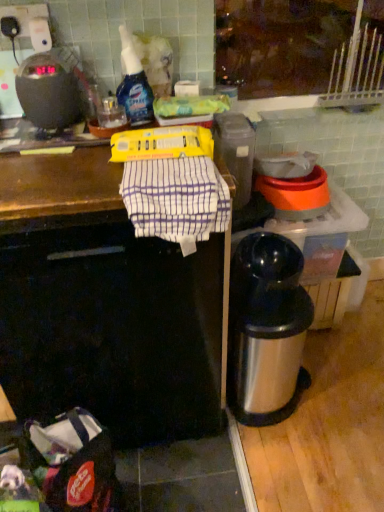
Describe the element at coordinates (50, 91) in the screenshot. This screenshot has height=512, width=384. I see `black plastic scale at upper left` at that location.

This screenshot has width=384, height=512. I want to click on white striped cloth at center, so click(176, 200).

Locate an element on the screen. This screenshot has width=384, height=512. white striped cloth at center is located at coordinates (105, 307).

Identify the location of black plastic scale at upper left. The image size is (384, 512). (50, 91).

Which object is closer to the camera taking this photo, black plastic scale at upper left or white striped cloth at center?

white striped cloth at center is in front.

Where is `kitchen appliance above the white striped cloth at center (from the image's perspective)`? This screenshot has height=512, width=384. kitchen appliance above the white striped cloth at center (from the image's perspective) is located at coordinates (50, 91).

Is black plastic scale at upper left oriented towards white striped cloth at center?

No, black plastic scale at upper left is not facing towards white striped cloth at center.

From the picture: How many degrees apart are the facing directions of black plastic scale at upper left and white striped cloth at center?

0.00224 degrees separate the facing orientations of black plastic scale at upper left and white striped cloth at center.

Does black plastic scale at upper left have a greater height compared to white striped cloth at center?

No, black plastic scale at upper left is not taller than white striped cloth at center.

From a real-world perspective, does black plastic scale at upper left sit lower than white striped cloth at center?

Incorrect, from a real-world perspective, black plastic scale at upper left is higher than white striped cloth at center.

How much distance is there between black plastic scale at upper left and white striped cloth at center?

black plastic scale at upper left and white striped cloth at center are 20.41 inches apart.

Which object is wider, black plastic scale at upper left or white striped cloth at center?

Wider between the two is white striped cloth at center.

Is translucent plastic spray bottle at upper center not near white striped cloth at center?

They are positioned close to each other.

What are the coordinates of `laundry below the translucent plastic spray bottle at upper center (from a real-world perspective)` in the screenshot? It's located at (176, 200).

Considering the sizes of translucent plastic spray bottle at upper center and white striped cloth at center in the image, is translucent plastic spray bottle at upper center wider or thinner than white striped cloth at center?

In the image, translucent plastic spray bottle at upper center appears to be more narrow than white striped cloth at center.

Based on the photo, considering their positions, is translucent plastic spray bottle at upper center located in front of or behind white striped cloth at center?

Clearly, translucent plastic spray bottle at upper center is behind white striped cloth at center.

Looking at this image, is white striped cloth at center oriented towards black plastic scale at upper left?

No, white striped cloth at center is not oriented towards black plastic scale at upper left.

Which is correct: white striped cloth at center is inside black plastic scale at upper left, or outside of it?

white striped cloth at center is located beyond the bounds of black plastic scale at upper left.

From a real-world perspective, relative to black plastic scale at upper left, is white striped cloth at center vertically above or below?

Clearly, from a real-world perspective, white striped cloth at center is below black plastic scale at upper left.

Is white striped cloth at center shorter than black plastic scale at upper left?

Yes.

Is white striped cloth at center at the back of silver metallic thermos at lower right?

No, silver metallic thermos at lower right is not facing away from white striped cloth at center.

Can you confirm if silver metallic thermos at lower right is smaller than white striped cloth at center?

Yes.

Who is more distant, silver metallic thermos at lower right or white striped cloth at center?

silver metallic thermos at lower right is further away from the camera.

Is silver metallic thermos at lower right not near white striped cloth at center?

No, silver metallic thermos at lower right is not far away from white striped cloth at center.

Is white striped cloth at center spatially inside black plastic scale at upper left, or outside of it?

white striped cloth at center is spatially situated outside black plastic scale at upper left.

Considering the points (65, 244) and (23, 79), which point is behind, point (65, 244) or point (23, 79)?

The point (23, 79) is farther.

Is white striped cloth at center touching black plastic scale at upper left?

white striped cloth at center is not next to black plastic scale at upper left, and they're not touching.

Which of these two, white striped cloth at center or white striped cloth at center, stands taller?

white striped cloth at center.

Is white striped cloth at center inside or outside of white striped cloth at center?

white striped cloth at center fits inside white striped cloth at center.

Are white striped cloth at center and white striped cloth at center located far from each other?

No.

What's the angular difference between white striped cloth at center and white striped cloth at center's facing directions?

The facing directions of white striped cloth at center and white striped cloth at center are 0.00124 degrees apart.

Find the location of a particular element. kitchen appliance behind the white striped cloth at center is located at coordinates (50, 91).

What are the coordinates of `kitchen appliance that is on the left side of white striped cloth at center` in the screenshot? It's located at (50, 91).

In the scene shown: Estimate the real-world distances between objects in this image. Which object is further from white striped cloth at center, silver metallic thermos at lower right or black plastic scale at upper left?

black plastic scale at upper left lies further to white striped cloth at center than the other object.

Which object lies further to the anchor point translucent plastic spray bottle at upper center, silver metallic thermos at lower right or black plastic scale at upper left?

The object further to translucent plastic spray bottle at upper center is silver metallic thermos at lower right.

Looking at the image, which one is located further to translucent plastic spray bottle at upper center, silver metallic thermos at lower right or white striped cloth at center?

Among the two, silver metallic thermos at lower right is located further to translucent plastic spray bottle at upper center.

Looking at the image, which one is located closer to white striped cloth at center, silver metallic thermos at lower right or translucent plastic spray bottle at upper center?

silver metallic thermos at lower right is closer to white striped cloth at center.

From the picture: Which object lies nearer to the anchor point white striped cloth at center, white striped cloth at center or black plastic scale at upper left?

white striped cloth at center is positioned closer to the anchor white striped cloth at center.

Looking at the image, which one is located further to black plastic scale at upper left, translucent plastic spray bottle at upper center or white striped cloth at center?

white striped cloth at center is further to black plastic scale at upper left.

Looking at the image, which one is located further to white striped cloth at center, white striped cloth at center or translucent plastic spray bottle at upper center?

The object further to white striped cloth at center is translucent plastic spray bottle at upper center.

From the image, which object appears to be nearer to white striped cloth at center, silver metallic thermos at lower right or black plastic scale at upper left?

→ The object closer to white striped cloth at center is silver metallic thermos at lower right.

Where is `laundry located between white striped cloth at center and silver metallic thermos at lower right in the left-right direction`? laundry located between white striped cloth at center and silver metallic thermos at lower right in the left-right direction is located at coordinates (176, 200).

Identify the location of kitchen appliance between translucent plastic spray bottle at upper center and silver metallic thermos at lower right in the up-down direction. The height and width of the screenshot is (512, 384). (50, 91).

In order to click on laundry between black plastic scale at upper left and silver metallic thermos at lower right vertically in this screenshot , I will do `click(176, 200)`.

Where is `kitchen appliance between translucent plastic spray bottle at upper center and white striped cloth at center in the vertical direction`? This screenshot has width=384, height=512. kitchen appliance between translucent plastic spray bottle at upper center and white striped cloth at center in the vertical direction is located at coordinates (50, 91).